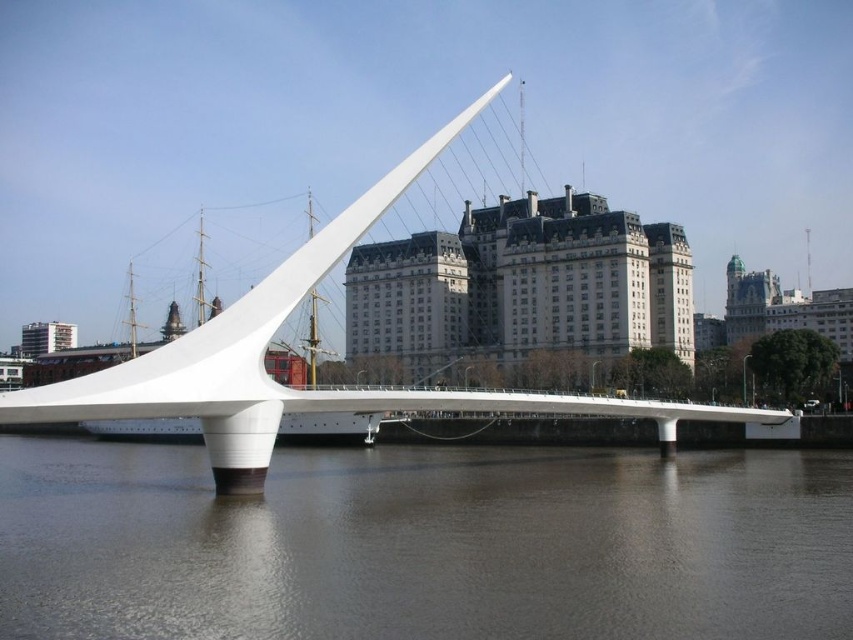
You are standing on the Puente de la Mujer bridge and want to take a photo of the brown reflective water at center. According to the coordinates provided, where exactly should you position yourself to capture the reflection in the water?

The brown reflective water at center is located at coordinates point (425, 545), so you should position yourself at that point to capture the reflection in the water.

You are a photographer planning to capture the entire structure of the white smooth bridge at center and the brown reflective water at center in one frame. Considering their sizes, which object should you focus on to ensure both are fully visible in the photo?

The brown reflective water at center is smaller than the white smooth bridge at center, so you should focus on the white smooth bridge at center to ensure both objects are fully visible in the photo.

You are standing on the Puente de la Mujer bridge and looking towards the historic building in the background. There is a point marked at coordinates (x=425, y=545). What is located at this point?

The point at coordinates (x=425, y=545) corresponds to brown reflective water at center.